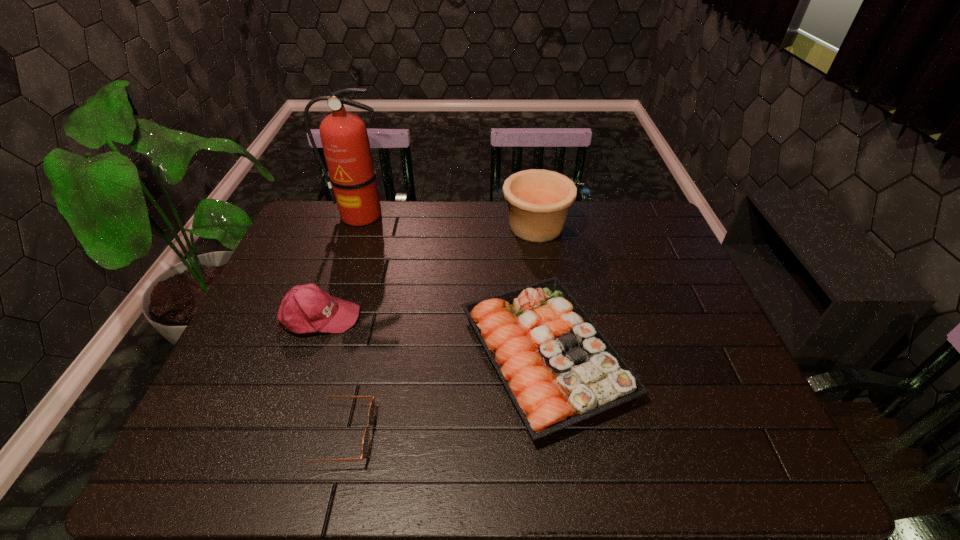
You are a GUI agent. You are given a task and a screenshot of the screen. Output one action in this format:
    pyautogui.click(x=<x>, y=<y>)
    Task: Click on the tallest object
    The image size is (960, 540).
    Given the screenshot: What is the action you would take?
    pyautogui.click(x=351, y=179)

Locate an element on the screen. The width and height of the screenshot is (960, 540). the second tallest object is located at coordinates (538, 200).

Locate an element on the screen. The width and height of the screenshot is (960, 540). baseball cap is located at coordinates (306, 308).

Locate an element on the screen. platter is located at coordinates (558, 368).

Locate an element on the screen. sunglasses is located at coordinates (371, 412).

Where is `free location located on the side of the tallest object with the nozzle and handle`? free location located on the side of the tallest object with the nozzle and handle is located at coordinates (346, 259).

The image size is (960, 540). What are the coordinates of `blank space located 0.340m on the front of the pottery` in the screenshot? It's located at (552, 332).

Find the location of a particular element. vacant space located at the front of the baseball cap with the brim is located at coordinates (461, 316).

You are a GUI agent. You are given a task and a screenshot of the screen. Output one action in this format:
    pyautogui.click(x=<x>, y=<y>)
    Task: Click on the free space located 0.120m on the back of the platter
    This screenshot has width=960, height=540.
    Given the screenshot: What is the action you would take?
    pyautogui.click(x=533, y=258)

This screenshot has width=960, height=540. I want to click on free point located 0.110m on the front-facing side of the sunglasses, so click(x=423, y=435).